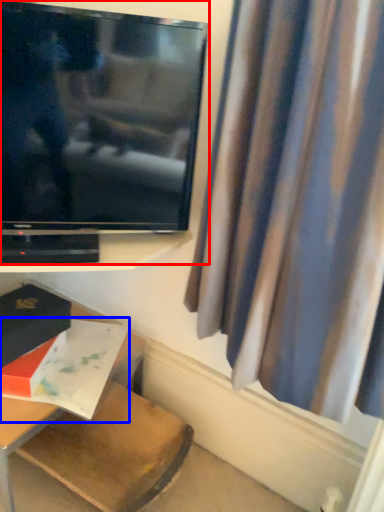
Question: Among these objects, which one is farthest to the camera, television (highlighted by a red box) or book (highlighted by a blue box)?

Choices:
 (A) television
 (B) book

Answer: (B)